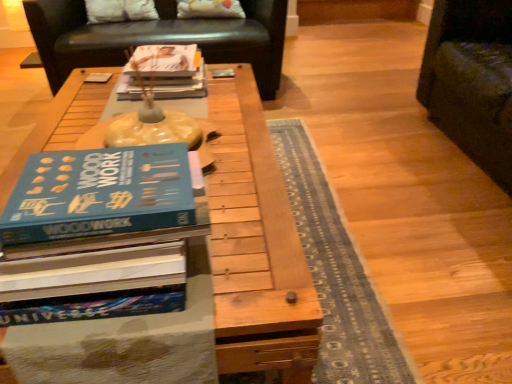
Question: Is white fabric pillow at upper center, the 2th pillow viewed from the right, not inside wooden table at center?

Choices:
 (A) no
 (B) yes

Answer: (B)

Question: Is white fabric pillow at upper center, the 2th pillow viewed from the right, oriented towards wooden table at center?

Choices:
 (A) yes
 (B) no

Answer: (A)

Question: Is white fabric pillow at upper center, the 2th pillow viewed from the right, bigger than wooden table at center?

Choices:
 (A) yes
 (B) no

Answer: (B)

Question: Considering the relative sizes of white fabric pillow at upper center, which is counted as the first pillow, starting from the left, and wooden table at center in the image provided, is white fabric pillow at upper center, which is counted as the first pillow, starting from the left, taller than wooden table at center?

Choices:
 (A) yes
 (B) no

Answer: (B)

Question: Is white fabric pillow at upper center, the 2th pillow viewed from the right, smaller than wooden table at center?

Choices:
 (A) yes
 (B) no

Answer: (A)

Question: Considering their positions, is white fabric pillow at upper center, which is counted as the first pillow, starting from the left, located in front of or behind black leather couch at upper center?

Choices:
 (A) behind
 (B) front

Answer: (A)

Question: From the image's perspective, relative to black leather couch at upper center, is white fabric pillow at upper center, the 2th pillow viewed from the right, above or below?

Choices:
 (A) above
 (B) below

Answer: (A)

Question: Based on their sizes in the image, would you say white fabric pillow at upper center, the 2th pillow viewed from the right, is bigger or smaller than black leather couch at upper center?

Choices:
 (A) small
 (B) big

Answer: (A)

Question: Is white fabric pillow at upper center, the 2th pillow viewed from the right, taller or shorter than black leather couch at upper center?

Choices:
 (A) short
 (B) tall

Answer: (A)

Question: From a real-world perspective, relative to matte paper book at center, is black leather couch at upper center vertically above or below?

Choices:
 (A) above
 (B) below

Answer: (B)

Question: Choose the correct answer: Is black leather couch at upper center inside matte paper book at center or outside it?

Choices:
 (A) inside
 (B) outside

Answer: (B)

Question: From their relative heights in the image, would you say black leather couch at upper center is taller or shorter than matte paper book at center?

Choices:
 (A) tall
 (B) short

Answer: (A)

Question: From the image's perspective, is black leather couch at upper center positioned above or below matte paper book at center?

Choices:
 (A) below
 (B) above

Answer: (B)

Question: Which is correct: white fabric pillow at upper center, which is counted as the first pillow, starting from the left, is inside white fabric pillow at upper center, the second pillow viewed from the left, or outside of it?

Choices:
 (A) outside
 (B) inside

Answer: (A)

Question: Is white fabric pillow at upper center, which is counted as the first pillow, starting from the left, to the left or to the right of white fabric pillow at upper center, the second pillow viewed from the left, in the image?

Choices:
 (A) left
 (B) right

Answer: (A)